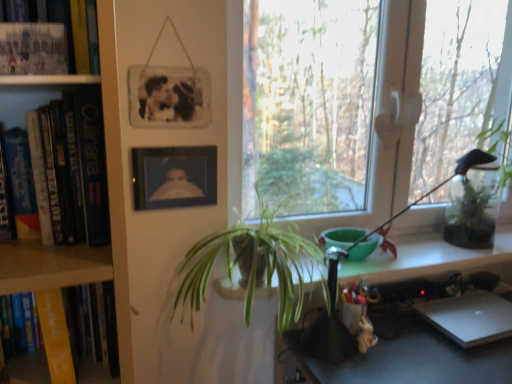
This screenshot has width=512, height=384. I want to click on free location to the left of silver metallic laptop at lower right, so click(410, 339).